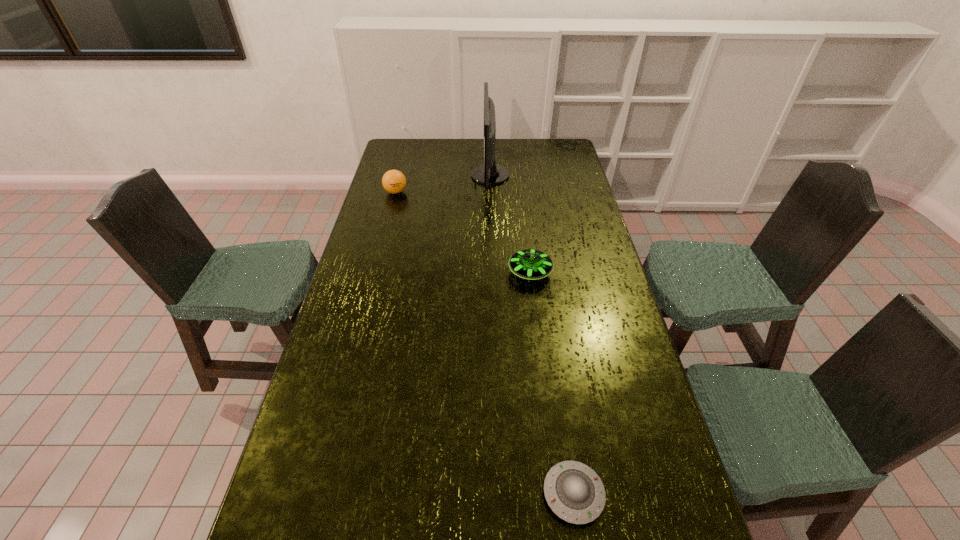
Image resolution: width=960 pixels, height=540 pixels. Identify the location of monitor. (489, 173).

The height and width of the screenshot is (540, 960). Find the location of `the leftmost object`. the leftmost object is located at coordinates (393, 181).

The height and width of the screenshot is (540, 960). Find the location of `the third shortest object`. the third shortest object is located at coordinates (393, 181).

Identify the location of the taller saucer. (529, 264).

Image resolution: width=960 pixels, height=540 pixels. In order to click on the farther saucer in this screenshot , I will do `click(529, 264)`.

Locate an element on the screen. The image size is (960, 540). the shorter saucer is located at coordinates (575, 493).

I want to click on the nearer saucer, so click(575, 493).

Find the location of `blank space located on the screen side of the tallest object`. blank space located on the screen side of the tallest object is located at coordinates (460, 176).

This screenshot has width=960, height=540. Identify the location of vacant space positioned on the screen side of the tallest object. (418, 176).

At what (x,y) coordinates should I click in order to perform the action: click on free region located 0.160m on the screen side of the tallest object. Please return your answer as a coordinate pair (x, y). Looking at the image, I should click on (437, 176).